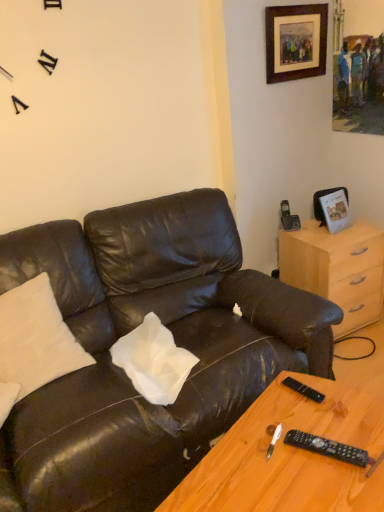
Identify the location of vacant area that lies to the right of black plastic remote at lower right, which is the second remote from top to bottom. (364, 435).